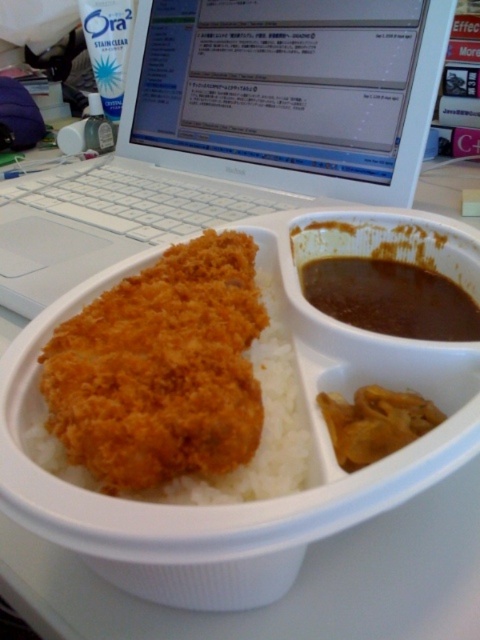
You are a food delivery person who needs to pack this meal into a smaller container. You notice the brown thick gravy at lower right and the brown crumbly curry at center. Which of these two has a wider spread in the container?

The brown thick gravy at lower right has a wider spread in the container than the brown crumbly curry at center because its width surpasses the latter.

You are organizing items on a desk and need to place a new item between the white plastic laptop at upper center and the golden crispy breaded cutlet at center. Based on their positions, where should you place the new item?

The new item should be placed to the right of the white plastic laptop at upper center and to the left of the golden crispy breaded cutlet at center since the laptop is to the left of the cutlet.

You are a student who just received a meal in a white segmented plastic container on your desk. You need to place your white plastic laptop at upper center back on the desk without spilling any of the meal compartments. Where should you place the laptop so it doesn not interfere with the meal compartments?

The white plastic laptop at upper center should be placed at point (233,131) to avoid interfering with the meal compartments.